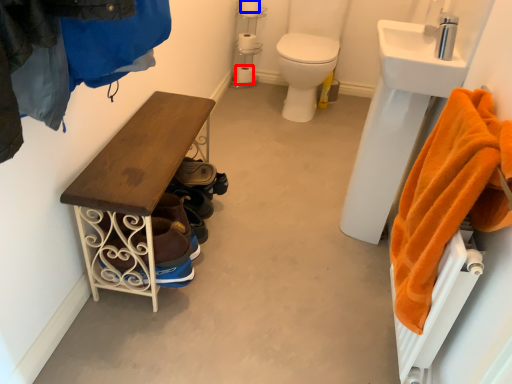
Question: Which point is closer to the camera, toilet paper (highlighted by a red box) or toilet paper (highlighted by a blue box)?

Choices:
 (A) toilet paper
 (B) toilet paper

Answer: (B)